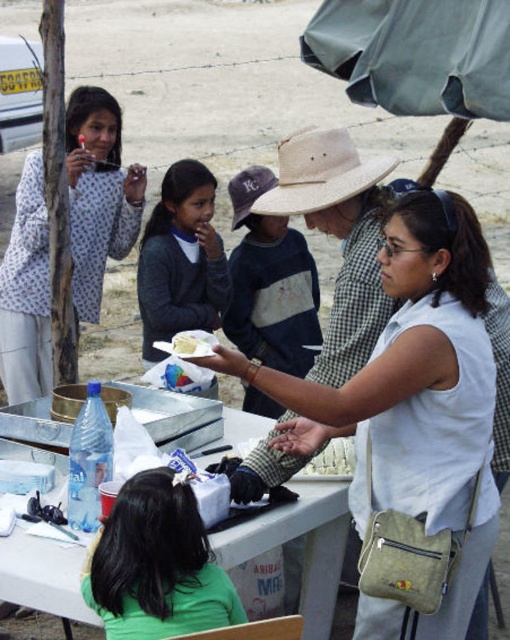
You are setting up a picnic and need to know if the dark blue cotton shirt at center can be laid flat on the white plastic table at center without folding. Can it fit?

The white plastic table at center has a width less than the dark blue cotton shirt at center, so it cannot be laid flat without folding.

You are at a picnic and see two cakes, a white crumbly cake at center and a yellow cake at center. Which cake is located to the right?

The white crumbly cake at center is to the right of the yellow cake at center.

You are at a picnic and see both the white crumbly cake at center and the yellow cake at center. Which cake is positioned higher?

The yellow cake at center is positioned higher than the white crumbly cake at center.